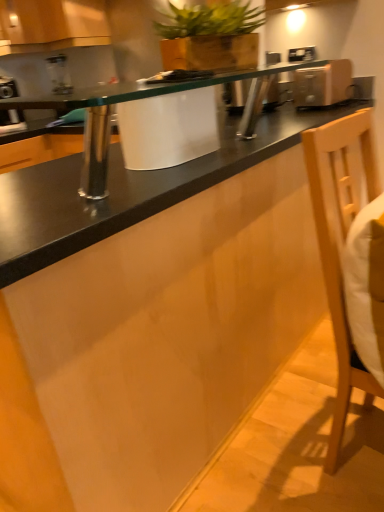
Question: From the image's perspective, is wooden planter at upper center on light wood swivel chair at right?

Choices:
 (A) yes
 (B) no

Answer: (A)

Question: From a real-world perspective, is wooden planter at upper center physically above light wood swivel chair at right?

Choices:
 (A) no
 (B) yes

Answer: (B)

Question: Is wooden planter at upper center far from light wood swivel chair at right?

Choices:
 (A) yes
 (B) no

Answer: (A)

Question: Is wooden planter at upper center taller than light wood swivel chair at right?

Choices:
 (A) no
 (B) yes

Answer: (A)

Question: Does wooden planter at upper center touch light wood swivel chair at right?

Choices:
 (A) no
 (B) yes

Answer: (A)

Question: Is wooden cabinet at upper left inside the boundaries of metallic silver toaster at upper left, arranged as the 1th appliance when viewed from the left, or outside?

Choices:
 (A) outside
 (B) inside

Answer: (A)

Question: Is wooden cabinet at upper left wider or thinner than metallic silver toaster at upper left, arranged as the 1th appliance when viewed from the left?

Choices:
 (A) wide
 (B) thin

Answer: (A)

Question: From a real-world perspective, is wooden cabinet at upper left above or below metallic silver toaster at upper left, the second appliance positioned from the front?

Choices:
 (A) below
 (B) above

Answer: (B)

Question: Visually, is wooden cabinet at upper left positioned to the left or to the right of metallic silver toaster at upper left, the first appliance viewed from the back?

Choices:
 (A) left
 (B) right

Answer: (B)

Question: Considering the positions of wooden planter at upper center and wooden cabinet at upper left in the image, is wooden planter at upper center bigger or smaller than wooden cabinet at upper left?

Choices:
 (A) small
 (B) big

Answer: (A)

Question: Is wooden planter at upper center in front of or behind wooden cabinet at upper left in the image?

Choices:
 (A) front
 (B) behind

Answer: (A)

Question: Does point (193, 45) appear closer or farther from the camera than point (69, 11)?

Choices:
 (A) closer
 (B) farther

Answer: (A)

Question: From a real-world perspective, relative to wooden cabinet at upper left, is wooden planter at upper center vertically above or below?

Choices:
 (A) above
 (B) below

Answer: (B)

Question: Considering the positions of wooden cabinet at upper left and light wood swivel chair at right in the image, is wooden cabinet at upper left bigger or smaller than light wood swivel chair at right?

Choices:
 (A) big
 (B) small

Answer: (A)

Question: From a real-world perspective, is wooden cabinet at upper left physically located above or below light wood swivel chair at right?

Choices:
 (A) above
 (B) below

Answer: (A)